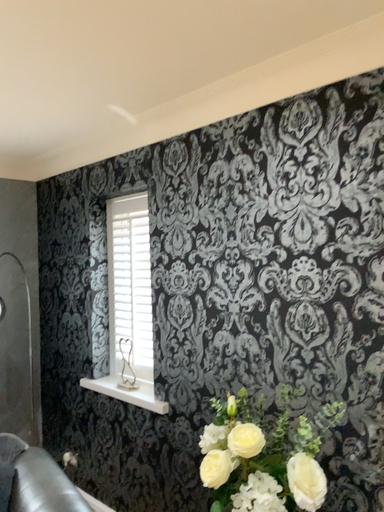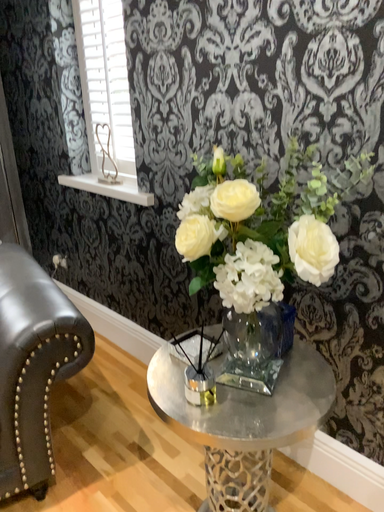
Question: Which way did the camera rotate in the video?

Choices:
 (A) rotated upward
 (B) rotated downward

Answer: (B)